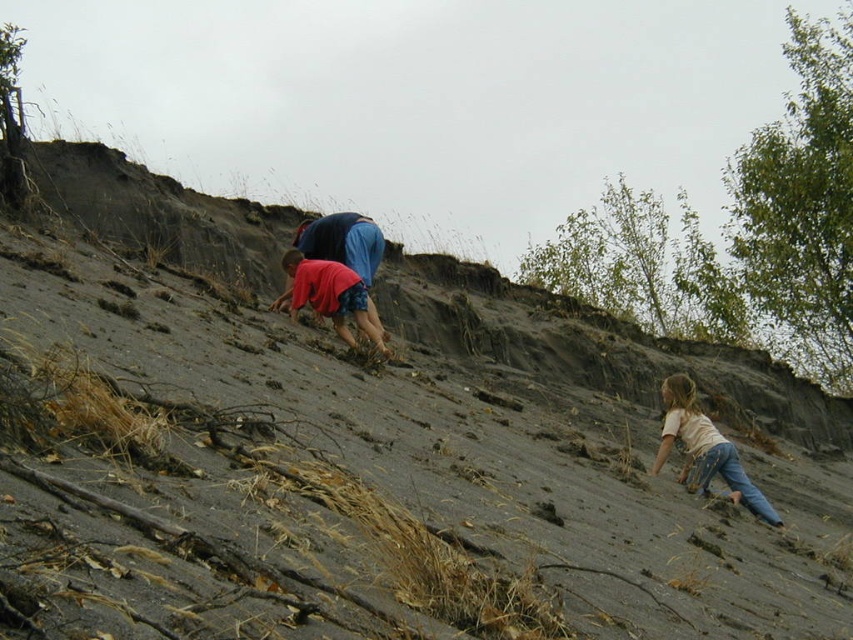
Question: Is light beige denim jeans at lower right bigger than matte red shirt at center?

Choices:
 (A) no
 (B) yes

Answer: (B)

Question: Where is light beige denim jeans at lower right located in relation to matte red shirt at center in the image?

Choices:
 (A) above
 (B) below

Answer: (B)

Question: Which of the following is the farthest from the observer?

Choices:
 (A) (328, 291)
 (B) (753, 499)

Answer: (A)

Question: Which point appears farthest from the camera in this image?

Choices:
 (A) (309, 276)
 (B) (660, 464)

Answer: (A)

Question: Does light beige denim jeans at lower right appear on the right side of matte red shirt at center?

Choices:
 (A) no
 (B) yes

Answer: (B)